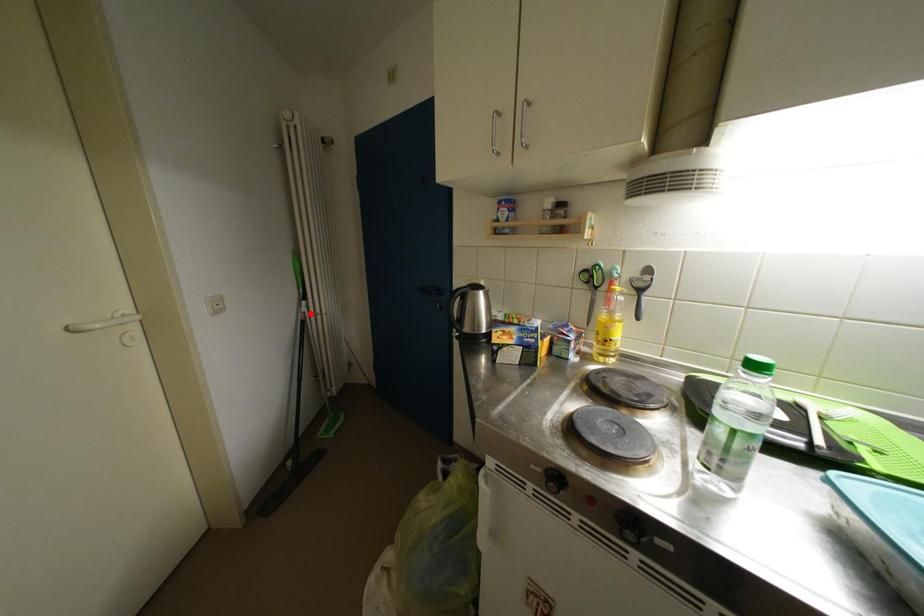
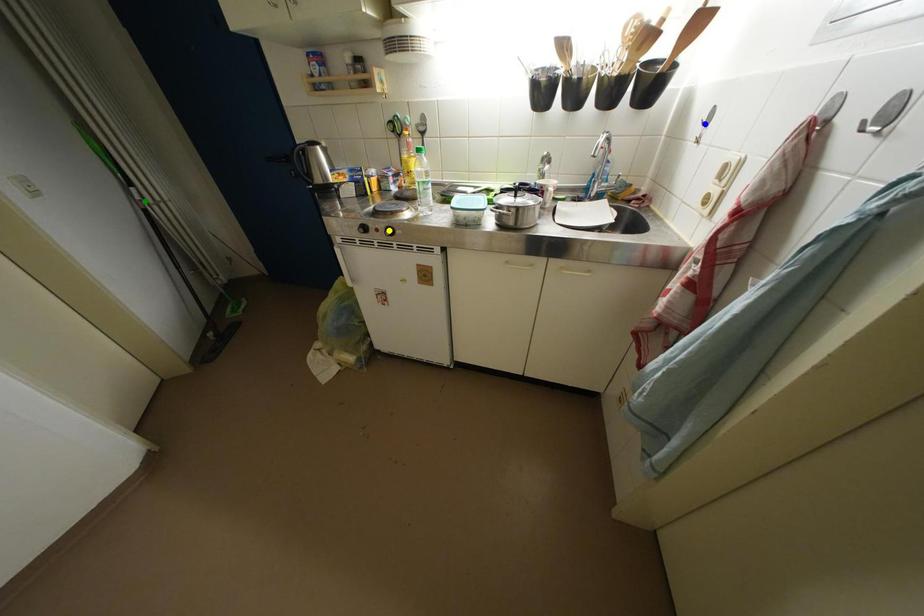
Question: I am providing you with two images of the same scene from different viewpoints. A red point is marked on the first image. You are given multiple points on the second image. Which point in image 2 is actually the same real-world point as the red point in image 1?

Choices:
 (A) yellow point
 (B) green point
 (C) blue point

Answer: (B)